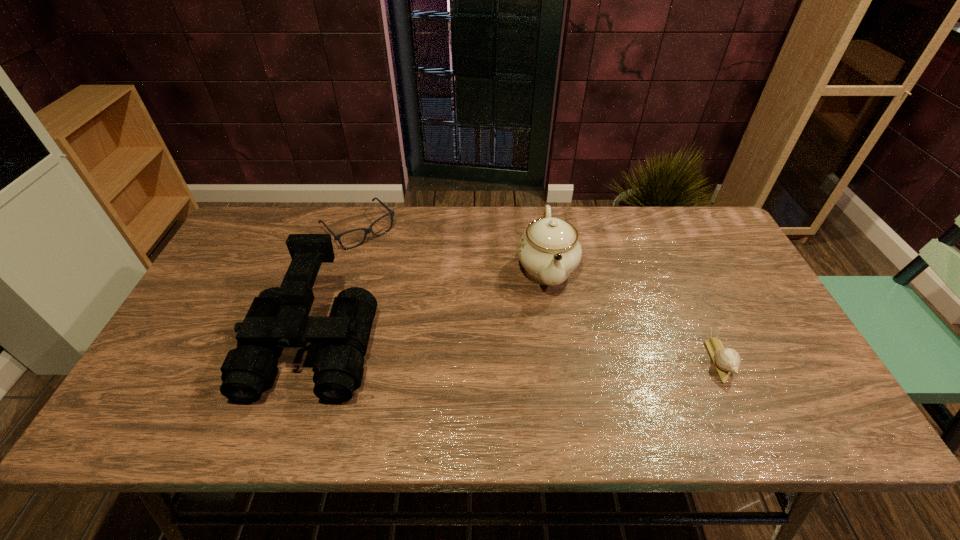
Where is `vacant space in between the second object from right to left and the escargot`? Image resolution: width=960 pixels, height=540 pixels. vacant space in between the second object from right to left and the escargot is located at coordinates (633, 314).

Select which object is the closest to the escargot. Please provide its 2D coordinates. Your answer should be formatted as a tuple, i.e. [(x, y)], where the tuple contains the x and y coordinates of a point satisfying the conditions above.

[(549, 250)]

Locate which object is the second closest to the binoculars. Please provide its 2D coordinates. Your answer should be formatted as a tuple, i.e. [(x, y)], where the tuple contains the x and y coordinates of a point satisfying the conditions above.

[(549, 250)]

Where is `free spot that satisfies the following two spatial constraints: 1. on the front side of the third object from left to right; 2. on the left side of the spectacles`? Image resolution: width=960 pixels, height=540 pixels. free spot that satisfies the following two spatial constraints: 1. on the front side of the third object from left to right; 2. on the left side of the spectacles is located at coordinates (347, 268).